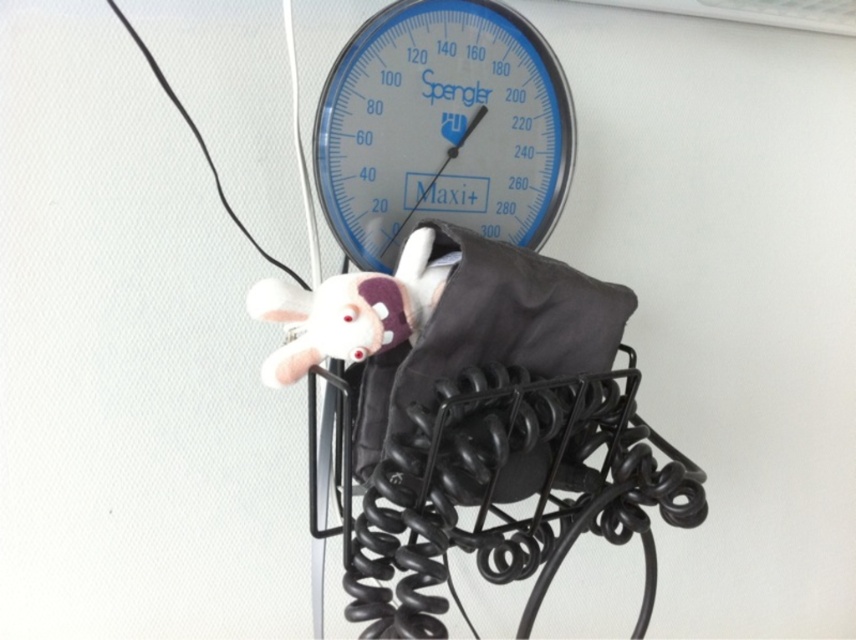
Can you confirm if blue glass gauge at center is wider than white plush toy at center?

Yes.

Who is positioned more to the right, blue glass gauge at center or white plush toy at center?

Positioned to the right is blue glass gauge at center.

Measure the distance between blue glass gauge at center and camera.

blue glass gauge at center is 38.64 inches away from camera.

Locate an element on the screen. blue glass gauge at center is located at coordinates (443, 129).